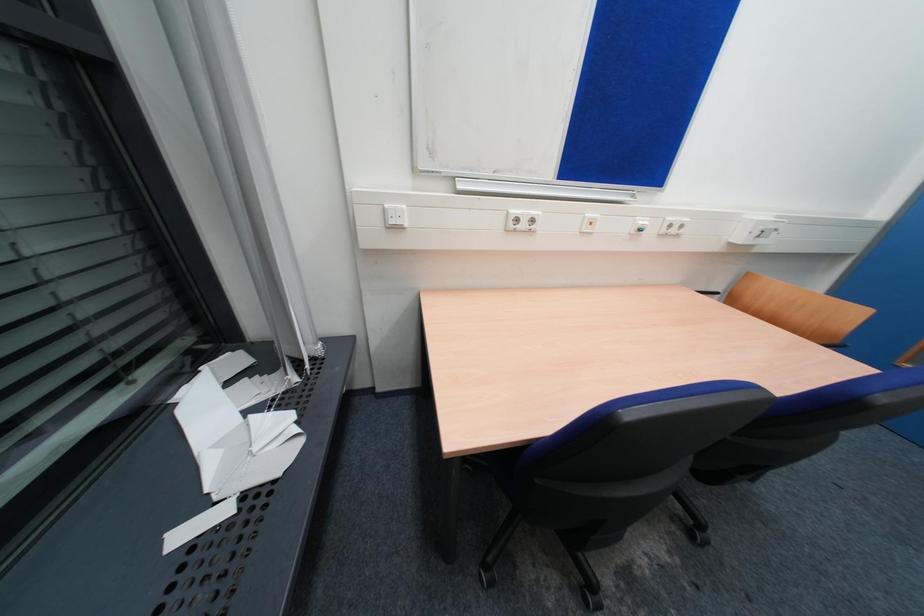
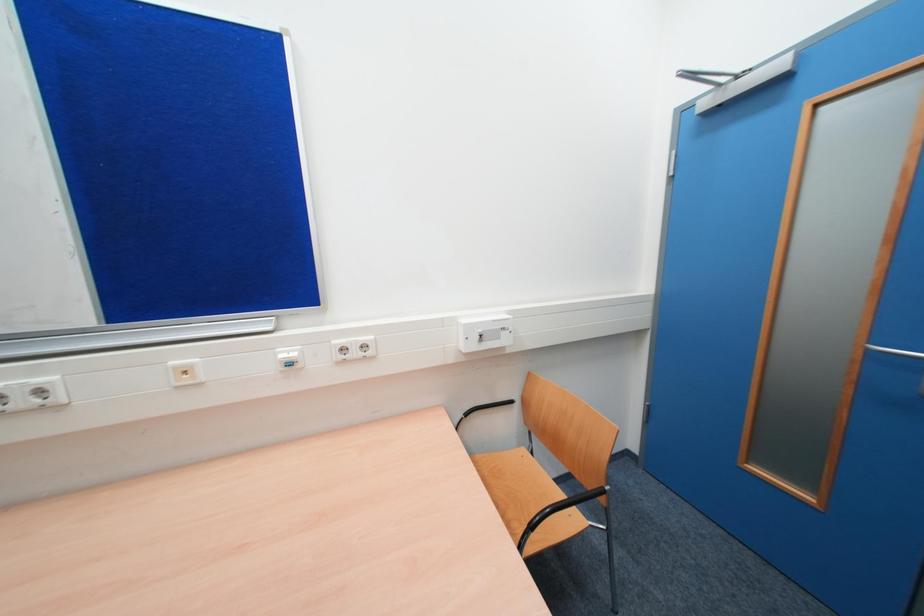
Question: Which direction would the cameraman need to move to produce the second image? Reply with the corresponding letter.

Choices:
 (A) Left
 (B) Right
 (C) Forward
 (D) Backward

Answer: (B)